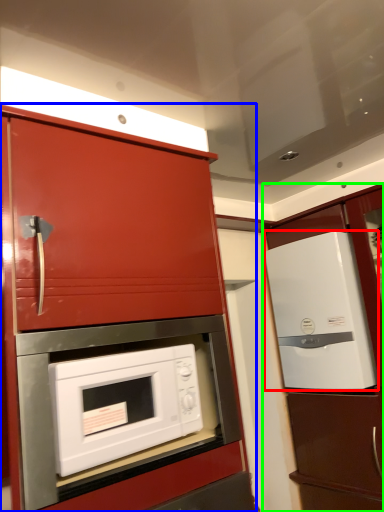
Question: Estimate the real-world distances between objects in this image. Which object is farther from refrigerator (highlighted by a red box), cabinetry (highlighted by a blue box) or cabinetry (highlighted by a green box)?

Choices:
 (A) cabinetry
 (B) cabinetry

Answer: (A)